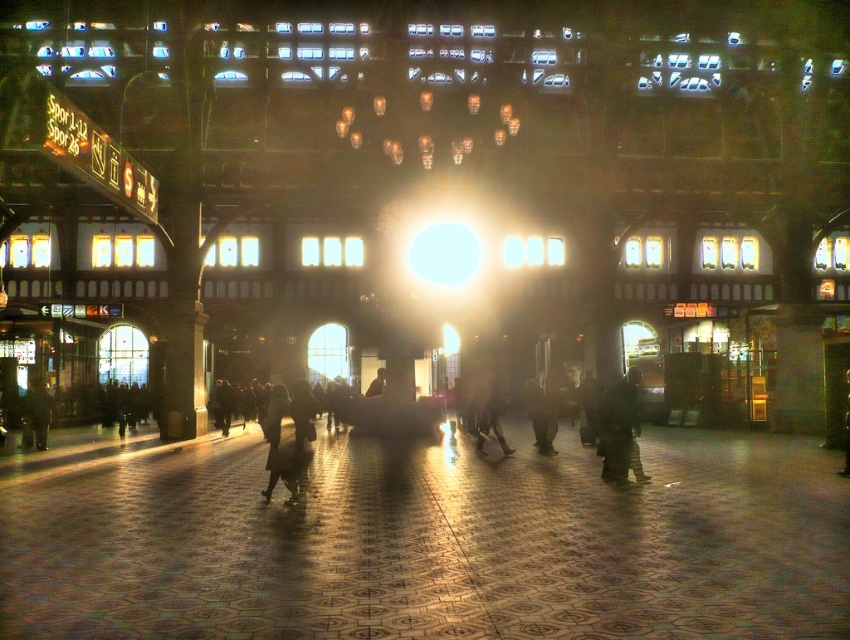
Between dark textured coat at center and dark brown leather jacket at lower right, which one has more height?

dark brown leather jacket at lower right

Can you confirm if dark textured coat at center is smaller than dark brown leather jacket at lower right?

Actually, dark textured coat at center might be larger than dark brown leather jacket at lower right.

Is point (482, 410) closer to viewer compared to point (848, 433)?

That is False.

This screenshot has height=640, width=850. In order to click on dark textured coat at center in this screenshot , I will do `click(489, 416)`.

Between dark gray pants at center and dark green fabric jacket at center, which one is positioned lower?

Positioned lower is dark gray pants at center.

Is dark gray pants at center positioned in front of dark green fabric jacket at center?

Yes, dark gray pants at center is in front of dark green fabric jacket at center.

Between point (307, 429) and point (620, 432), which one is positioned behind?

Positioned behind is point (620, 432).

Where is `dark gray pants at center`? The image size is (850, 640). dark gray pants at center is located at coordinates (289, 435).

Is point (605, 419) closer to viewer compared to point (847, 376)?

Yes, point (605, 419) is in front of point (847, 376).

Is point (635, 424) farther from camera compared to point (848, 378)?

No, it is not.

Is point (604, 476) less distant than point (845, 420)?

Yes.

Find the location of a particular element. The image size is (850, 640). dark green fabric jacket at center is located at coordinates (620, 428).